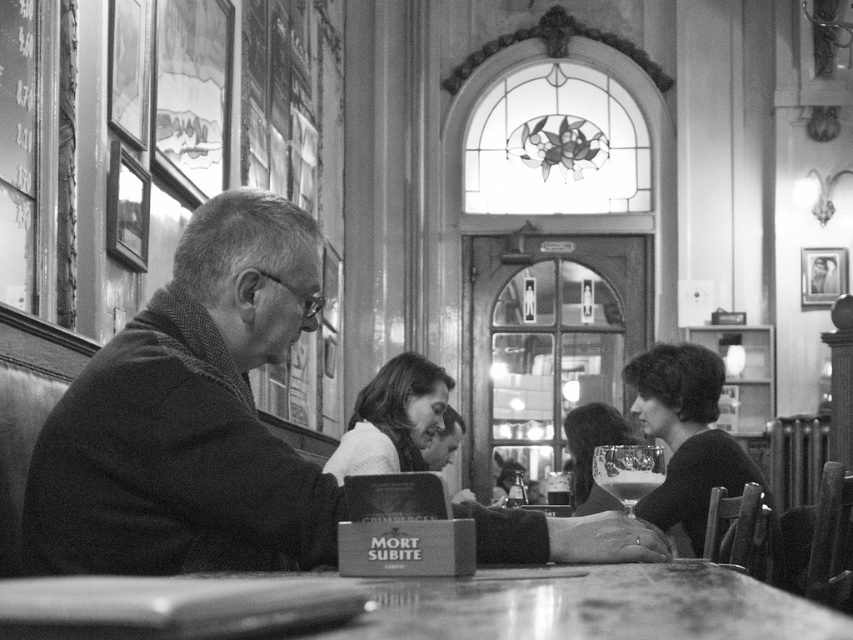
Which is below, smooth wool coat at left or smooth wooden table at center?

smooth wooden table at center

Between point (209, 234) and point (486, 637), which one is positioned in front?

Point (486, 637) is more forward.

Where is `smooth wool coat at left`? smooth wool coat at left is located at coordinates (190, 417).